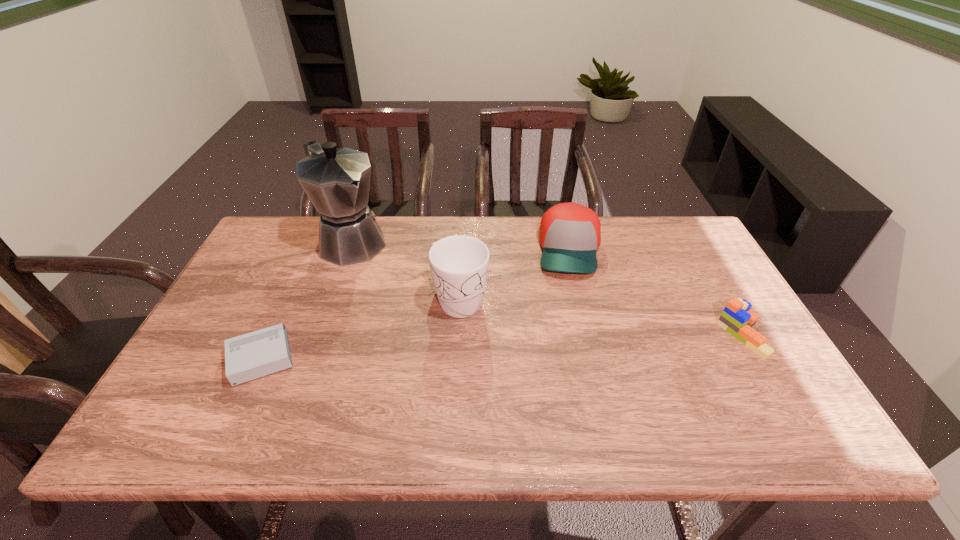
The image size is (960, 540). I want to click on the shortest object, so click(x=256, y=354).

Locate an element on the screen. Lego is located at coordinates (x=737, y=319).

The image size is (960, 540). Identify the location of the second shortest object. (737, 319).

Where is `coffeepot`? coffeepot is located at coordinates pyautogui.click(x=337, y=181).

In order to click on the third object from right to left in this screenshot , I will do [459, 264].

The image size is (960, 540). I want to click on the second tallest object, so pos(459,264).

This screenshot has width=960, height=540. What are the coordinates of `baseball cap` in the screenshot? It's located at (570, 234).

Identify the location of the fourth object from left to right. (570, 234).

Image resolution: width=960 pixels, height=540 pixels. I want to click on vacant space located on the right of the alarm clock, so click(x=330, y=356).

Find the location of a particular element. Image resolution: width=960 pixels, height=540 pixels. vacant area situated on the left of the second shortest object is located at coordinates (613, 335).